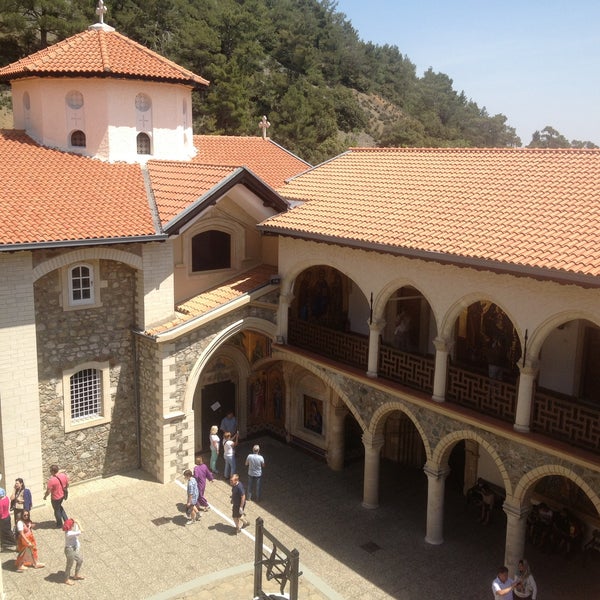
Find the location of `floor`. floor is located at coordinates (366, 558).